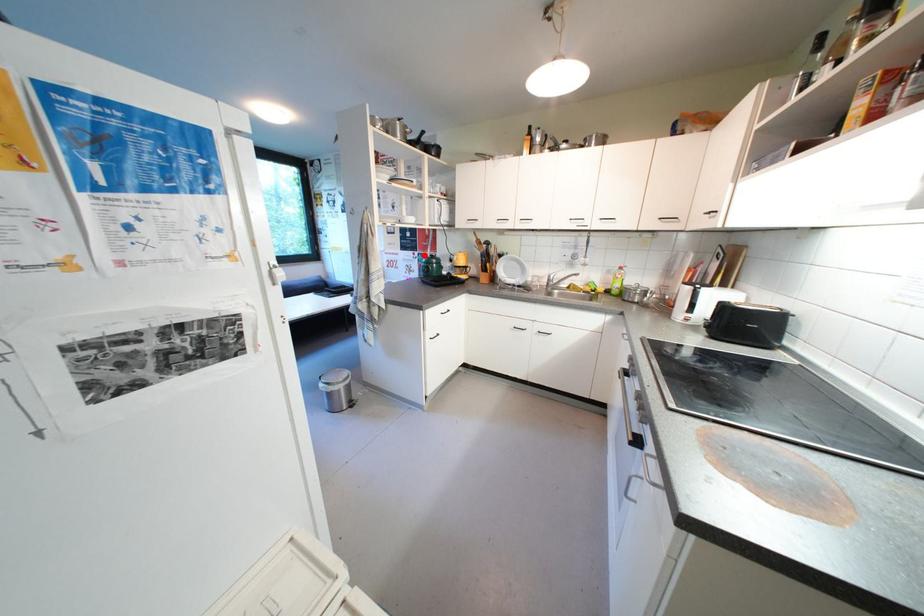
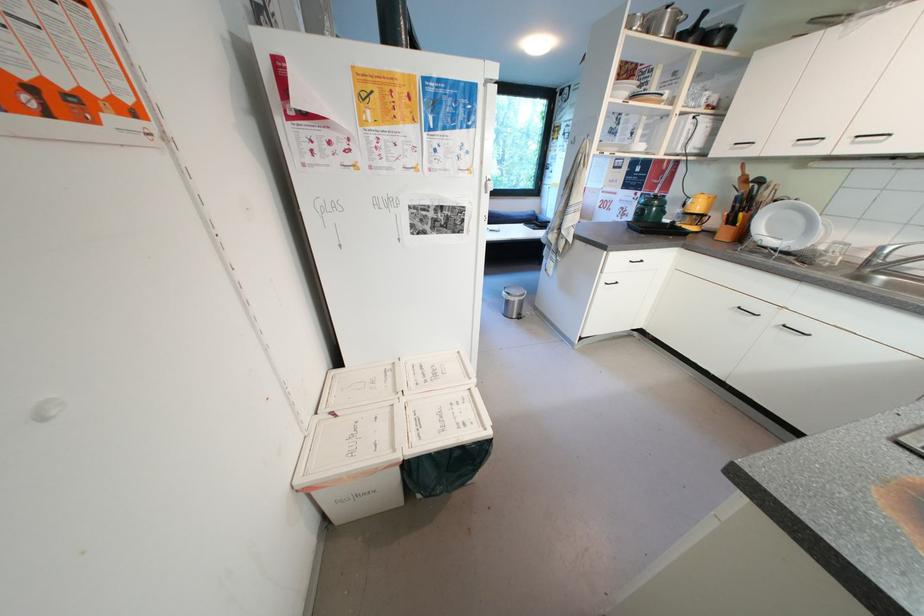
Question: A red point is marked in image1. In image2, is the corresponding 3D point closer to the camera or farther? Reply with the corresponding letter.

Choices:
 (A) The corresponding 3D point is closer.
 (B) The corresponding 3D point is farther.

Answer: (A)